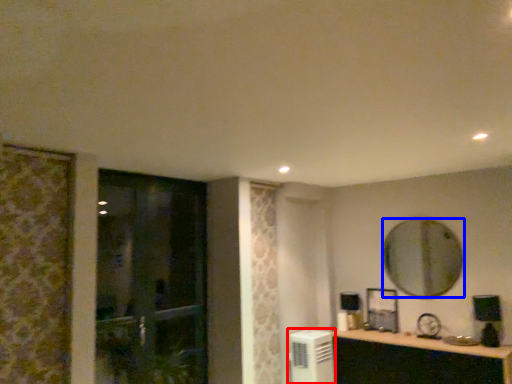
Question: Which object appears farthest to the camera in this image, air conditioner (highlighted by a red box) or mirror (highlighted by a blue box)?

Choices:
 (A) air conditioner
 (B) mirror

Answer: (A)